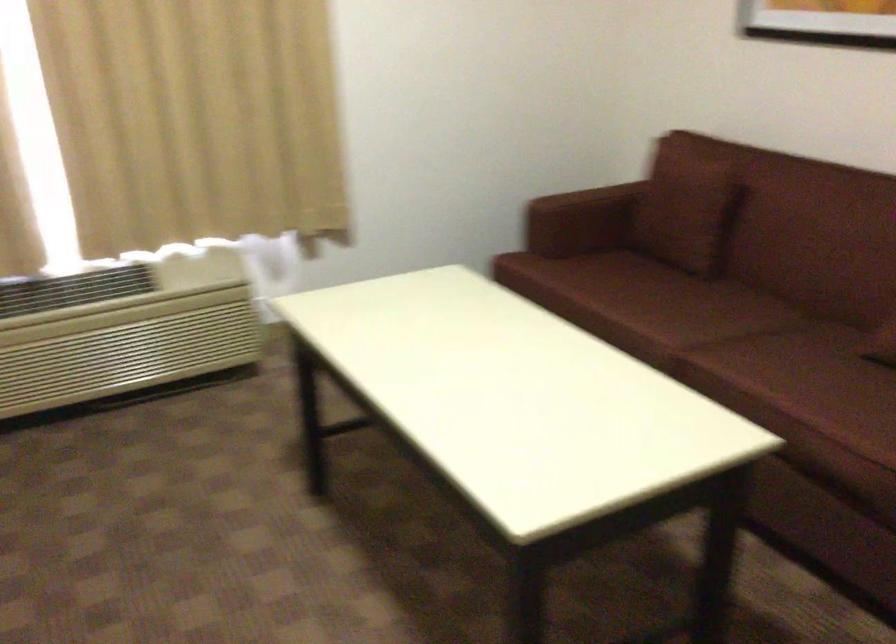
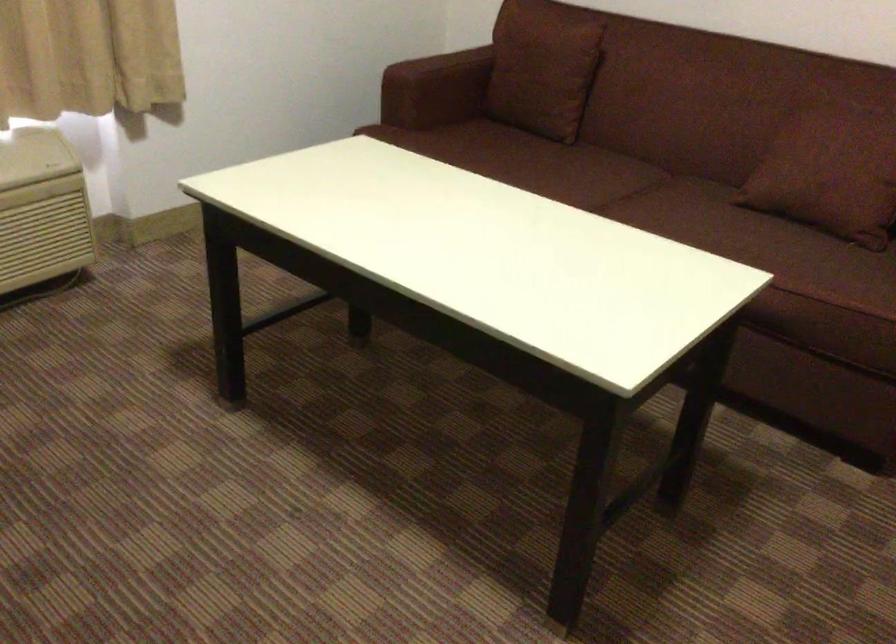
The point at (573, 196) is marked in the first image. Where is the corresponding point in the second image?

(441, 66)